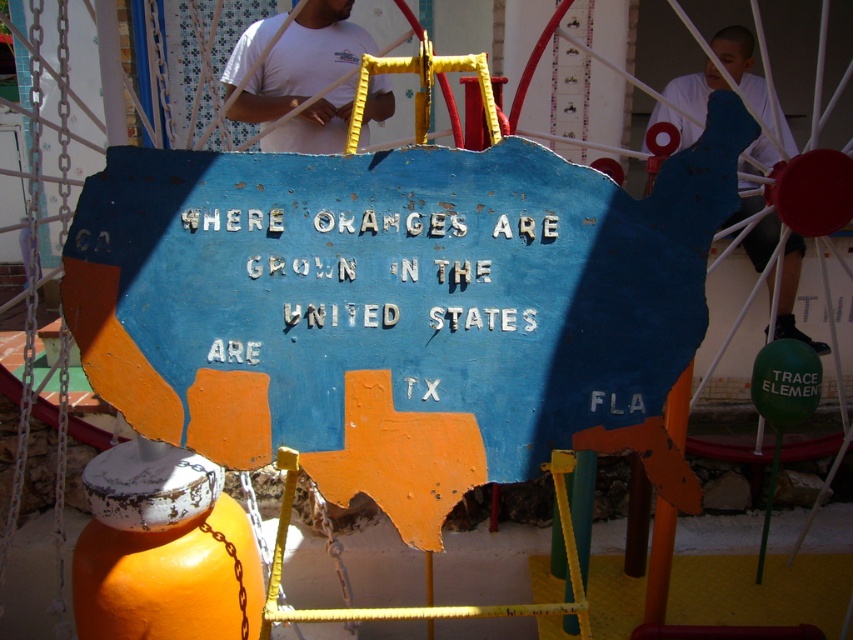
Question: Which object appears farthest from the camera in this image?

Choices:
 (A) white matte shirt at upper center
 (B) white cotton shirt at upper center

Answer: (B)

Question: Which object appears farthest from the camera in this image?

Choices:
 (A) white painted letters at center
 (B) white matte shirt at upper center

Answer: (B)

Question: Does white cotton shirt at upper center appear on the left side of white matte shirt at upper center?

Choices:
 (A) yes
 (B) no

Answer: (A)

Question: Considering the real-world distances, which object is closest to the white matte shirt at upper center?

Choices:
 (A) white painted letters at center
 (B) white cotton shirt at upper center

Answer: (B)

Question: Is white painted letters at center closer to the viewer compared to white matte shirt at upper center?

Choices:
 (A) yes
 (B) no

Answer: (A)

Question: In this image, where is white cotton shirt at upper center located relative to white matte shirt at upper center?

Choices:
 (A) above
 (B) below

Answer: (A)